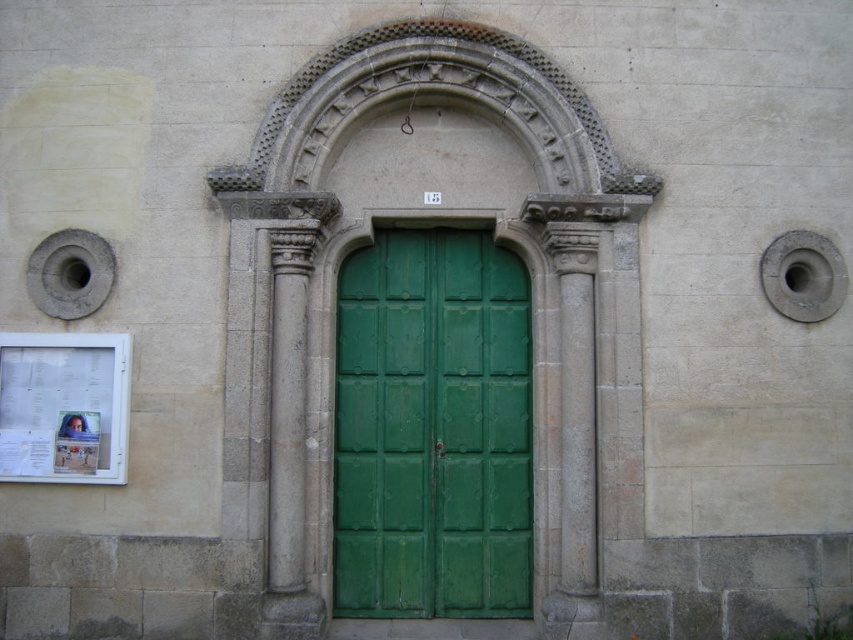
You are a delivery person with a cart that is 3 feet wide. You need to pass through the space between the green wooden door at center and the gray stone column at center. Can your cart fit through the space?

The distance between the green wooden door at center and the gray stone column at center is 3.74 feet, which is wider than the cart that is 3 feet wide. Therefore, the cart can fit through the space.

You are standing in front of the building and notice two points marked on the facade. The first point is at coordinate point (450,452) and the second is at point (299,392). Which point is closer to you?

Point (450,452) is further to the viewer than point (299,392). Therefore, point (299,392) is closer to you.